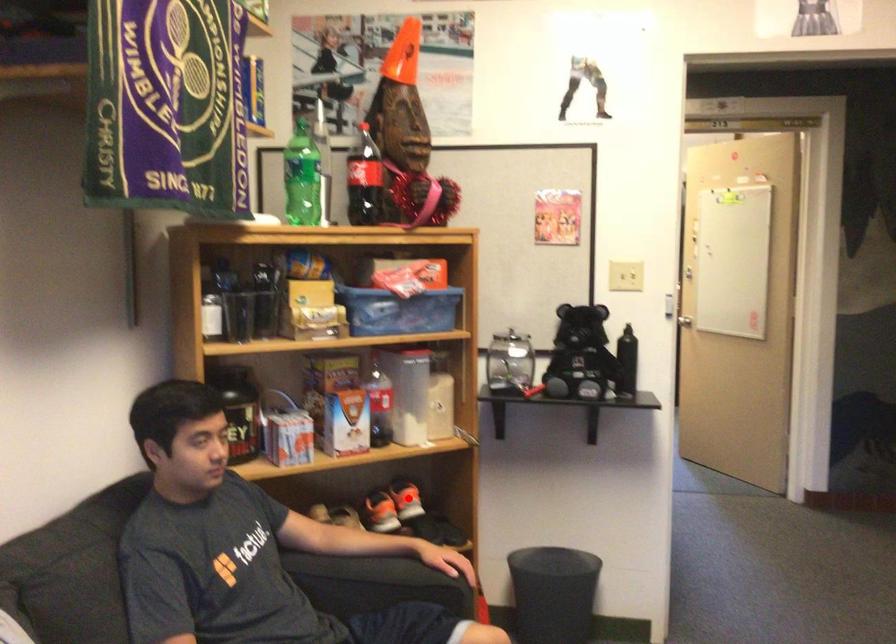
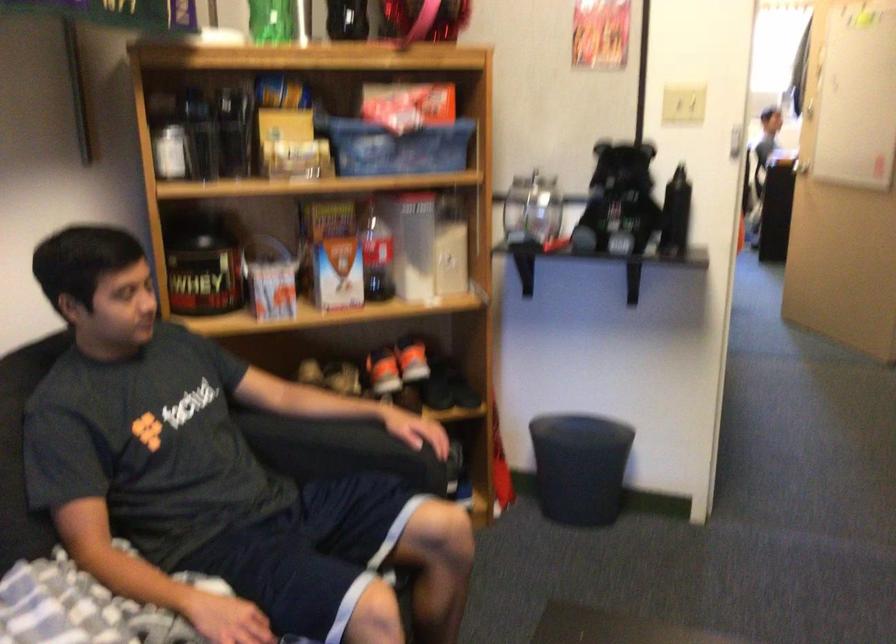
Find the pixel in the second image that matches the highlighted location in the first image.

(411, 359)